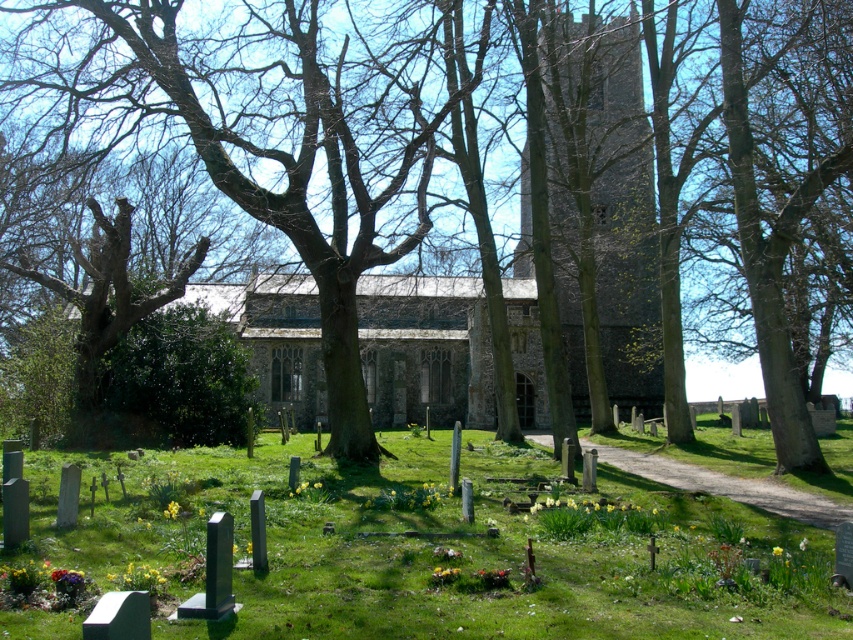
Question: Is green grassy at lower center to the right of gray stone tower at center from the viewer's perspective?

Choices:
 (A) no
 (B) yes

Answer: (A)

Question: Is green grassy at lower center positioned behind gray stone tower at center?

Choices:
 (A) no
 (B) yes

Answer: (A)

Question: Does green grassy at lower center appear on the right side of gray stone tower at center?

Choices:
 (A) no
 (B) yes

Answer: (A)

Question: Which point is closer to the camera taking this photo?

Choices:
 (A) (560, 209)
 (B) (160, 588)

Answer: (B)